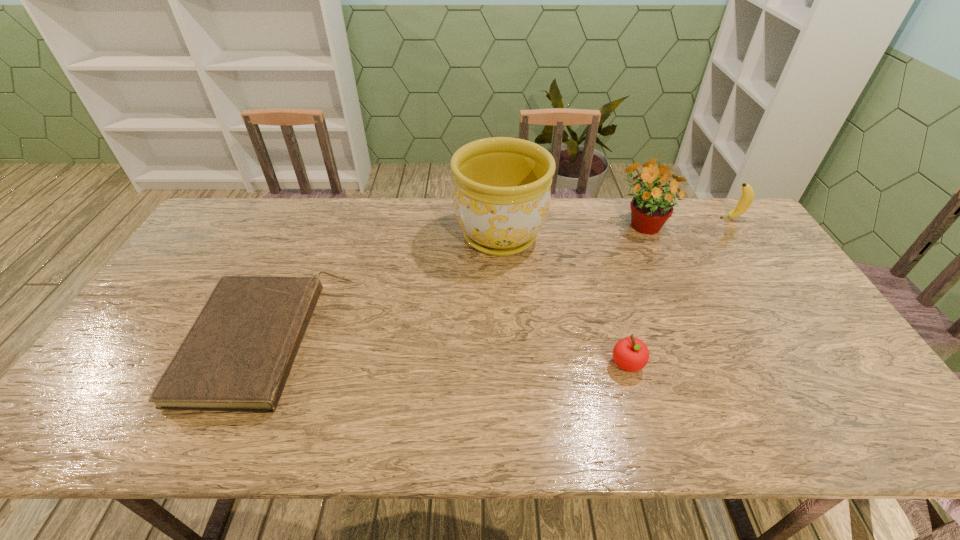
Identify the location of the left flowerpot. coord(502,186).

The width and height of the screenshot is (960, 540). I want to click on the right flowerpot, so 650,208.

Image resolution: width=960 pixels, height=540 pixels. In order to click on the third shortest object in this screenshot , I will do `click(746, 199)`.

Where is `banana`? Image resolution: width=960 pixels, height=540 pixels. banana is located at coordinates (746, 199).

At what (x,y) coordinates should I click in order to perform the action: click on the third object from left to right. Please return your answer as a coordinate pair (x, y). This screenshot has height=540, width=960. Looking at the image, I should click on (631, 354).

The height and width of the screenshot is (540, 960). In order to click on the second shortest object in this screenshot , I will do `click(631, 354)`.

You are a GUI agent. You are given a task and a screenshot of the screen. Output one action in this format:
    pyautogui.click(x=<x>, y=<y>)
    Task: Click on the paperback book
    This screenshot has width=960, height=540.
    Given the screenshot: What is the action you would take?
    pyautogui.click(x=237, y=356)

Where is `the leftmost object`? the leftmost object is located at coordinates (237, 356).

The image size is (960, 540). I want to click on vacant space situated on the front of the left flowerpot, so click(x=507, y=369).

What are the coordinates of `vacant space located on the left of the right flowerpot` in the screenshot? It's located at (592, 223).